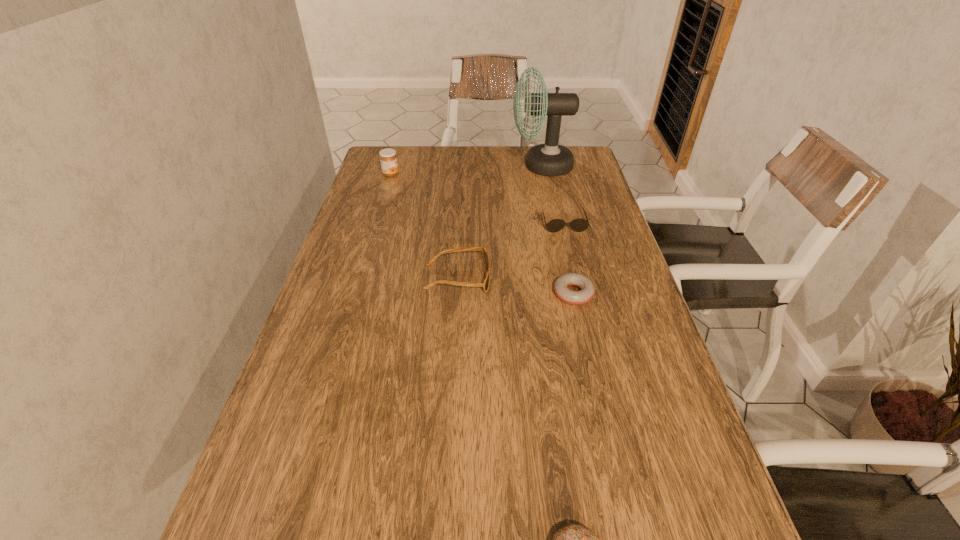
The image size is (960, 540). I want to click on fan, so click(x=550, y=159).

I want to click on the leftmost object, so coord(388,159).

You are a GUI agent. You are given a task and a screenshot of the screen. Output one action in this format:
    pyautogui.click(x=<x>, y=<y>)
    Task: Click on the jam
    The height and width of the screenshot is (540, 960).
    Given the screenshot: What is the action you would take?
    pyautogui.click(x=388, y=159)

Locate an element on the screen. The image size is (960, 540). the second object from left to right is located at coordinates (485, 284).

Locate an element on the screen. The width and height of the screenshot is (960, 540). the nearer sunglasses is located at coordinates 485,284.

Locate an element on the screen. the right sunglasses is located at coordinates tap(579, 225).

What are the coordinates of `the farther sunglasses` in the screenshot? It's located at (579, 225).

Image resolution: width=960 pixels, height=540 pixels. What are the coordinates of `the farther doughnut` in the screenshot? It's located at (561, 285).

Find the location of a particular element. This screenshot has width=960, height=540. free location located 0.210m in front of the tallest object where the airflow is directed is located at coordinates [450, 166].

The image size is (960, 540). What are the coordinates of `blank space located in front of the tallest object where the airflow is directed` in the screenshot? It's located at (411, 166).